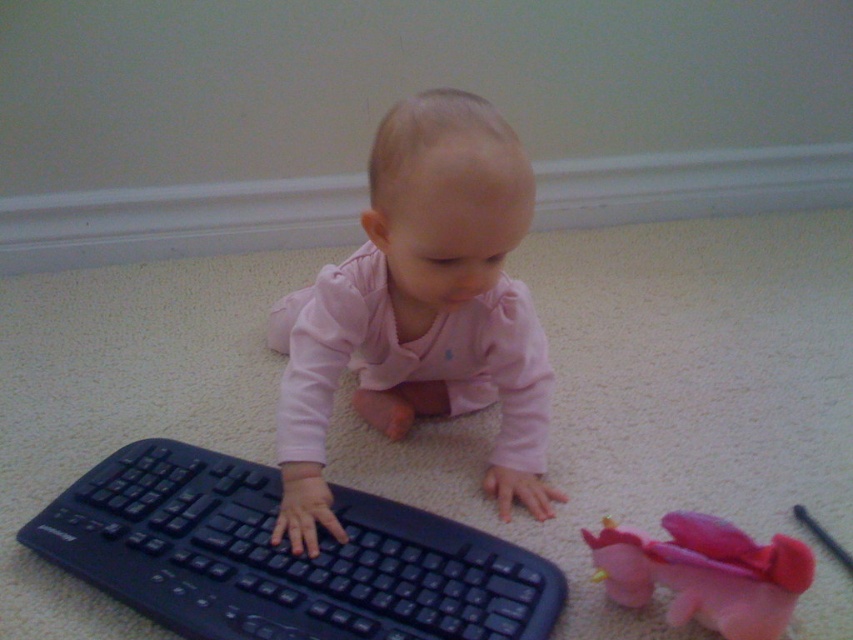
You are standing in the room and want to place a small toy car exactly at the point marked as point (189, 461). If you are currently 1.5 meters away from the wall, can you reach that point without moving closer to the wall?

The distance of point (189, 461) from viewer is 1.05 meters. Since you are currently 1.5 meters away from the wall, you can reach the point without moving closer because 1.05 meters is less than 1.5 meters.

You are a photographer setting up a shot of the scene. You want to focus on the pink matte baby at center and the pink fabric dragon at lower right. Which object should you adjust your camera focus to first if you want to capture both in sharp detail?

You should focus on the pink matte baby at center first because it is closer to the viewer than the pink fabric dragon at lower right, ensuring both will be in focus when using a shallow depth of field.

You are a parent who wants to retrieve the pink fabric dragon at lower right for your baby. The baby is currently focused on the black plastic keyboard at center. Can you reach the dragon without moving the keyboard?

The pink fabric dragon at lower right is behind the black plastic keyboard at center, so you can reach it without moving the keyboard.